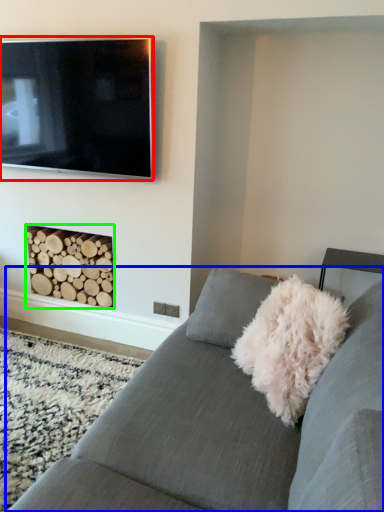
Question: Which is nearer to the television (highlighted by a red box)? studio couch (highlighted by a blue box) or fireplace (highlighted by a green box).

Choices:
 (A) studio couch
 (B) fireplace

Answer: (B)